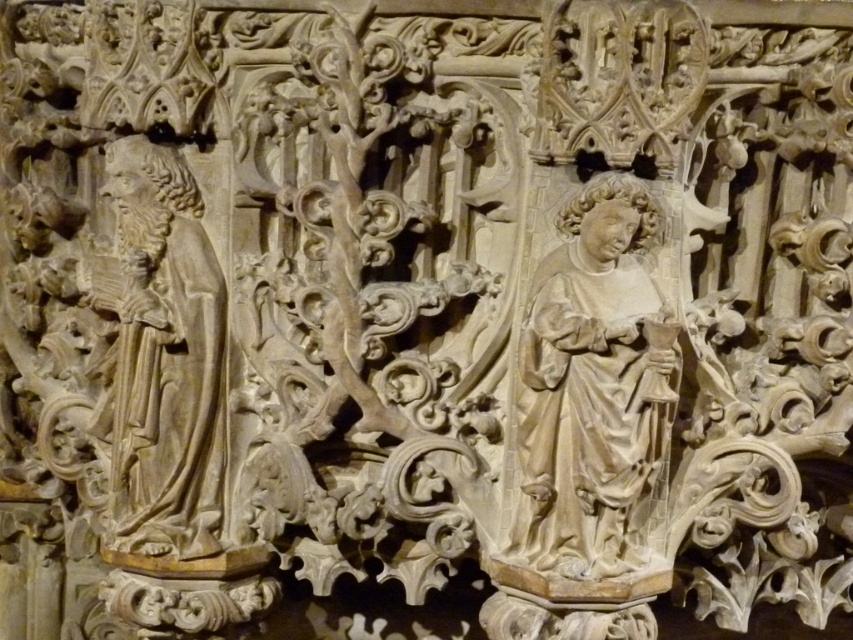
You are an art conservator examining the stone relief. You notice two points of concern marked at coordinates point [573,406] and point [131,193]. Which point is closer to you when looking at the relief?

Point [573,406] is in front of point [131,193], so it is closer to you.

You are an art conservator assessing the stone relief. You need to determine which of the two figures, the smooth beige statue at center or the carved stone figure at left, requires more space for storage. Based on their sizes, which one should be allocated more storage space?

The smooth beige statue at center should be allocated more storage space because its width is larger than that of the carved stone figure at left.

You are an art conservator examining the stone relief. You notice a specific point at coordinates (595, 387). What does this point correspond to in the relief?

The point at coordinates (595, 387) corresponds to the smooth beige statue at center.